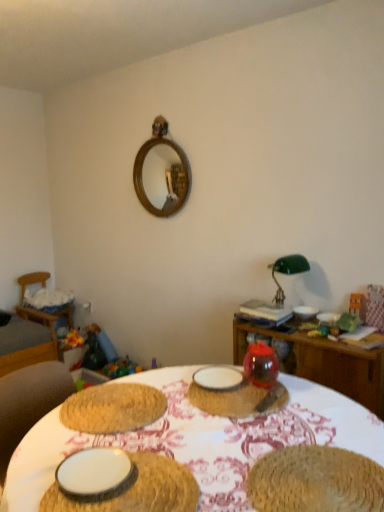
Question: Considering the relative sizes of white woven placemat at center, arranged as the second table when viewed from the back, and wooden mirror at upper center in the image provided, is white woven placemat at center, arranged as the second table when viewed from the back, shorter than wooden mirror at upper center?

Choices:
 (A) yes
 (B) no

Answer: (A)

Question: Considering the relative sizes of white woven placemat at center, arranged as the second table when viewed from the back, and wooden mirror at upper center in the image provided, is white woven placemat at center, arranged as the second table when viewed from the back, smaller than wooden mirror at upper center?

Choices:
 (A) yes
 (B) no

Answer: (B)

Question: From the image's perspective, is white woven placemat at center, arranged as the second table when viewed from the back, above wooden mirror at upper center?

Choices:
 (A) no
 (B) yes

Answer: (A)

Question: Considering the relative sizes of white woven placemat at center, arranged as the 1th table when viewed from the front, and wooden mirror at upper center in the image provided, is white woven placemat at center, arranged as the 1th table when viewed from the front, wider than wooden mirror at upper center?

Choices:
 (A) no
 (B) yes

Answer: (B)

Question: Is white woven placemat at center, arranged as the 1th table when viewed from the front, outside wooden mirror at upper center?

Choices:
 (A) no
 (B) yes

Answer: (B)

Question: Does white woven placemat at center, arranged as the second table when viewed from the back, have a greater height compared to wooden mirror at upper center?

Choices:
 (A) no
 (B) yes

Answer: (A)

Question: Is green glass table lamp at upper right directly adjacent to translucent glass vase at center, which appears as the second tableware when viewed from the front?

Choices:
 (A) no
 (B) yes

Answer: (A)

Question: From the image's perspective, is green glass table lamp at upper right below translucent glass vase at center, which appears as the second tableware when viewed from the front?

Choices:
 (A) yes
 (B) no

Answer: (B)

Question: Could you tell me if green glass table lamp at upper right is facing translucent glass vase at center, which is the third tableware from top to bottom?

Choices:
 (A) yes
 (B) no

Answer: (A)

Question: Is green glass table lamp at upper right at the left side of translucent glass vase at center, which ranks as the third tableware in left-to-right order?

Choices:
 (A) no
 (B) yes

Answer: (A)

Question: Considering the relative positions of green glass table lamp at upper right and translucent glass vase at center, which appears as the second tableware when viewed from the front, in the image provided, is green glass table lamp at upper right to the right of translucent glass vase at center, which appears as the second tableware when viewed from the front, from the viewer's perspective?

Choices:
 (A) yes
 (B) no

Answer: (A)

Question: From the image's perspective, is green glass table lamp at upper right on top of translucent glass vase at center, which appears as the second tableware when viewed from the front?

Choices:
 (A) yes
 (B) no

Answer: (A)

Question: Is white matte plate at lower left, placed as the fourth tableware when sorted from right to left, beside wooden table at center, the first table when ordered from back to front?

Choices:
 (A) no
 (B) yes

Answer: (A)